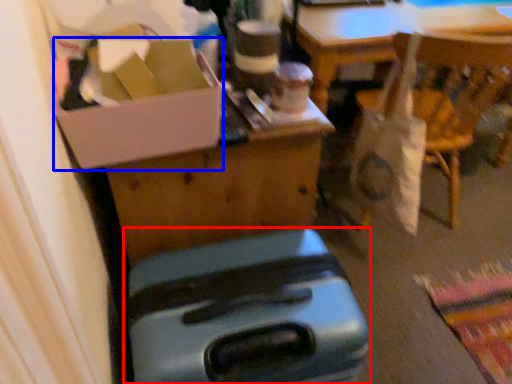
Question: Which object appears farthest to the camera in this image, luggage (highlighted by a red box) or box (highlighted by a blue box)?

Choices:
 (A) luggage
 (B) box

Answer: (B)